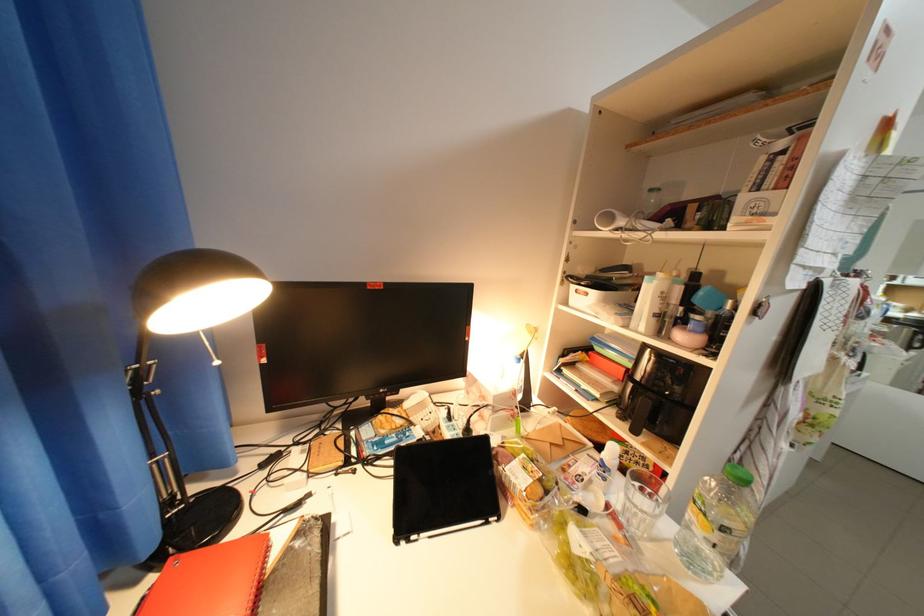
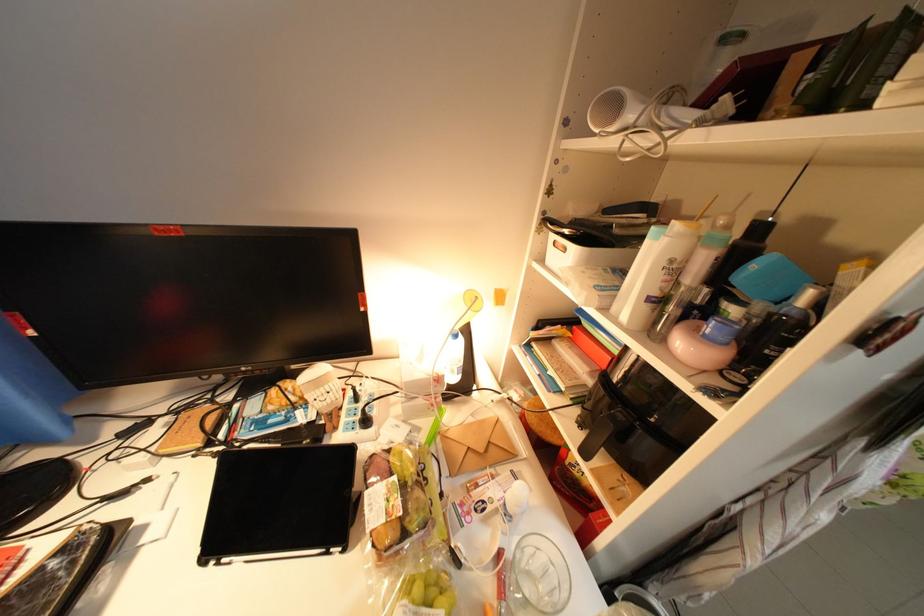
In the second image, find the point that corresponds to point (708, 277) in the first image.

(772, 230)